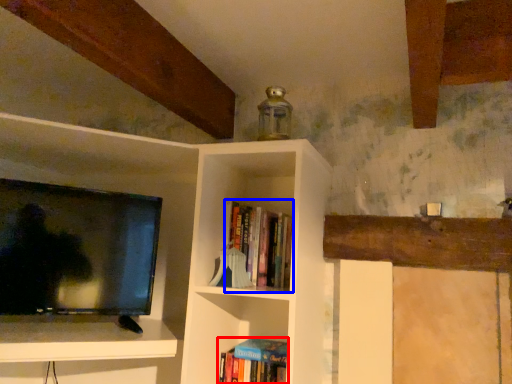
Question: Which object is further to the camera taking this photo, book (highlighted by a red box) or book (highlighted by a blue box)?

Choices:
 (A) book
 (B) book

Answer: (A)